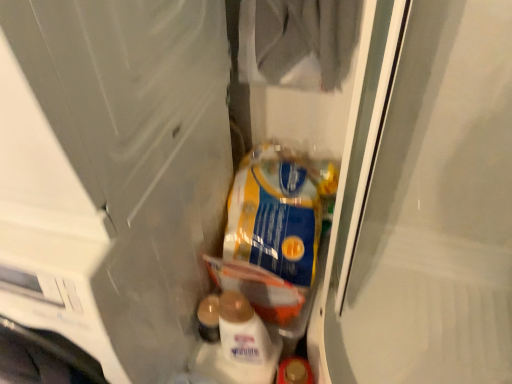
The image size is (512, 384). What do you see at coordinates (112, 173) in the screenshot? I see `transparent plastic screen door at left, marked as the 1th screen door in a left-to-right arrangement` at bounding box center [112, 173].

Find the location of a particular element. clear plastic bag at center, marked as the first screen door in a right-to-left arrangement is located at coordinates (434, 209).

Measure the distance between point (284, 173) and camera.

They are 1.16 meters apart.

Where is `transparent plastic screen door at left, marked as the 1th screen door in a left-to-right arrangement`? The width and height of the screenshot is (512, 384). transparent plastic screen door at left, marked as the 1th screen door in a left-to-right arrangement is located at coordinates (112, 173).

Who is smaller, blue/yellow plastic bag at center or transparent plastic screen door at left, marked as the 1th screen door in a left-to-right arrangement?

With smaller size is blue/yellow plastic bag at center.

Can you tell me how much blue/yellow plastic bag at center and transparent plastic screen door at left, which is the second screen door in right-to-left order, differ in facing direction?

0.169 degrees.

Can you see blue/yellow plastic bag at center touching transparent plastic screen door at left, marked as the 1th screen door in a left-to-right arrangement?

No, blue/yellow plastic bag at center is not beside transparent plastic screen door at left, marked as the 1th screen door in a left-to-right arrangement.

From the picture: Is transparent plastic screen door at left, marked as the 1th screen door in a left-to-right arrangement, directly adjacent to clear plastic bag at center, acting as the 2th screen door starting from the left?

They are not placed beside each other.

Can you confirm if transparent plastic screen door at left, marked as the 1th screen door in a left-to-right arrangement, is wider than clear plastic bag at center, acting as the 2th screen door starting from the left?

Yes, transparent plastic screen door at left, marked as the 1th screen door in a left-to-right arrangement, is wider than clear plastic bag at center, acting as the 2th screen door starting from the left.

Is transparent plastic screen door at left, marked as the 1th screen door in a left-to-right arrangement, turned away from clear plastic bag at center, acting as the 2th screen door starting from the left?

No.

Which of these two, transparent plastic screen door at left, which is the second screen door in right-to-left order, or clear plastic bag at center, marked as the first screen door in a right-to-left arrangement, is smaller?

With smaller size is transparent plastic screen door at left, which is the second screen door in right-to-left order.

From a real-world perspective, which is physically below, blue/yellow plastic bag at center or clear plastic bag at center, acting as the 2th screen door starting from the left?

From a 3D spatial view, blue/yellow plastic bag at center is below.

Looking at this image, is clear plastic bag at center, marked as the first screen door in a right-to-left arrangement, at the back of blue/yellow plastic bag at center?

blue/yellow plastic bag at center does not have its back to clear plastic bag at center, marked as the first screen door in a right-to-left arrangement.

From the image's perspective, does blue/yellow plastic bag at center appear higher than clear plastic bag at center, acting as the 2th screen door starting from the left?

Incorrect, from the image's perspective, blue/yellow plastic bag at center is lower than clear plastic bag at center, acting as the 2th screen door starting from the left.

Does point (272, 170) appear closer or farther from the camera than point (496, 318)?

Point (272, 170) appears to be closer to the viewer than point (496, 318).

From the image's perspective, is clear plastic bag at center, marked as the first screen door in a right-to-left arrangement, on top of blue/yellow plastic bag at center?

Indeed, from the image's perspective, clear plastic bag at center, marked as the first screen door in a right-to-left arrangement, is shown above blue/yellow plastic bag at center.

The height and width of the screenshot is (384, 512). Find the location of `screen door on the right of blue/yellow plastic bag at center`. screen door on the right of blue/yellow plastic bag at center is located at coordinates (434, 209).

Considering the sizes of objects clear plastic bag at center, acting as the 2th screen door starting from the left, and blue/yellow plastic bag at center in the image provided, who is smaller, clear plastic bag at center, acting as the 2th screen door starting from the left, or blue/yellow plastic bag at center?

Smaller between the two is blue/yellow plastic bag at center.

Image resolution: width=512 pixels, height=384 pixels. I want to click on screen door behind the clear plastic bag at center, marked as the first screen door in a right-to-left arrangement, so click(x=112, y=173).

Is clear plastic bag at center, marked as the first screen door in a right-to-left arrangement, inside the boundaries of transparent plastic screen door at left, which is the second screen door in right-to-left order, or outside?

clear plastic bag at center, marked as the first screen door in a right-to-left arrangement, is outside transparent plastic screen door at left, which is the second screen door in right-to-left order.

Considering the relative sizes of clear plastic bag at center, marked as the first screen door in a right-to-left arrangement, and transparent plastic screen door at left, which is the second screen door in right-to-left order, in the image provided, is clear plastic bag at center, marked as the first screen door in a right-to-left arrangement, shorter than transparent plastic screen door at left, which is the second screen door in right-to-left order,?

No.

Based on the photo, who is more distant, clear plastic bag at center, marked as the first screen door in a right-to-left arrangement, or transparent plastic screen door at left, marked as the 1th screen door in a left-to-right arrangement?

transparent plastic screen door at left, marked as the 1th screen door in a left-to-right arrangement, is further away from the camera.

How different are the orientations of transparent plastic screen door at left, marked as the 1th screen door in a left-to-right arrangement, and blue/yellow plastic bag at center in degrees?

They differ by 0.169 degrees in their facing directions.

You are a GUI agent. You are given a task and a screenshot of the screen. Output one action in this format:
    pyautogui.click(x=<x>, y=<y>)
    Task: Click on the 1st screen door in front of the blue/yellow plastic bag at center, starting your count from the anchor
    This screenshot has width=512, height=384.
    Given the screenshot: What is the action you would take?
    pyautogui.click(x=112, y=173)

Based on their positions, is transparent plastic screen door at left, which is the second screen door in right-to-left order, located to the left or right of blue/yellow plastic bag at center?

transparent plastic screen door at left, which is the second screen door in right-to-left order, is to the left of blue/yellow plastic bag at center.

Choose the correct answer: Is transparent plastic screen door at left, marked as the 1th screen door in a left-to-right arrangement, inside blue/yellow plastic bag at center or outside it?

transparent plastic screen door at left, marked as the 1th screen door in a left-to-right arrangement, is located beyond the bounds of blue/yellow plastic bag at center.

The image size is (512, 384). What are the coordinates of `product behind the transparent plastic screen door at left, which is the second screen door in right-to-left order` in the screenshot? It's located at (279, 211).

Find the location of a particular element. The height and width of the screenshot is (384, 512). screen door located above the transparent plastic screen door at left, marked as the 1th screen door in a left-to-right arrangement (from the image's perspective) is located at coordinates (434, 209).

When comparing their distances from clear plastic bag at center, marked as the first screen door in a right-to-left arrangement, does blue/yellow plastic bag at center or transparent plastic screen door at left, marked as the 1th screen door in a left-to-right arrangement, seem closer?

Based on the image, blue/yellow plastic bag at center appears to be nearer to clear plastic bag at center, marked as the first screen door in a right-to-left arrangement.

When comparing their distances from clear plastic bag at center, acting as the 2th screen door starting from the left, does transparent plastic screen door at left, which is the second screen door in right-to-left order, or blue/yellow plastic bag at center seem further?

transparent plastic screen door at left, which is the second screen door in right-to-left order, is positioned further to the anchor clear plastic bag at center, acting as the 2th screen door starting from the left.

Considering their positions, is transparent plastic screen door at left, marked as the 1th screen door in a left-to-right arrangement, positioned closer to blue/yellow plastic bag at center than clear plastic bag at center, marked as the first screen door in a right-to-left arrangement?

clear plastic bag at center, marked as the first screen door in a right-to-left arrangement, lies closer to blue/yellow plastic bag at center than the other object.

Consider the image. Based on their spatial positions, is clear plastic bag at center, acting as the 2th screen door starting from the left, or transparent plastic screen door at left, which is the second screen door in right-to-left order, further from blue/yellow plastic bag at center?

transparent plastic screen door at left, which is the second screen door in right-to-left order, is further to blue/yellow plastic bag at center.

From the image, which object appears to be farther from transparent plastic screen door at left, which is the second screen door in right-to-left order, clear plastic bag at center, acting as the 2th screen door starting from the left, or blue/yellow plastic bag at center?

clear plastic bag at center, acting as the 2th screen door starting from the left, lies further to transparent plastic screen door at left, which is the second screen door in right-to-left order, than the other object.

From the image, which object appears to be farther from transparent plastic screen door at left, which is the second screen door in right-to-left order, blue/yellow plastic bag at center or clear plastic bag at center, marked as the first screen door in a right-to-left arrangement?

Among the two, clear plastic bag at center, marked as the first screen door in a right-to-left arrangement, is located further to transparent plastic screen door at left, which is the second screen door in right-to-left order.

Where is `screen door between clear plastic bag at center, acting as the 2th screen door starting from the left, and blue/yellow plastic bag at center in the front-back direction`? screen door between clear plastic bag at center, acting as the 2th screen door starting from the left, and blue/yellow plastic bag at center in the front-back direction is located at coordinates (112, 173).